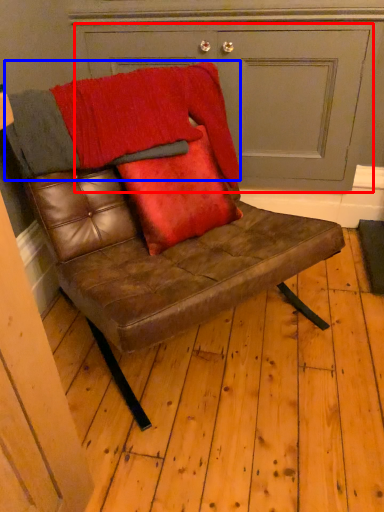
Question: Among these objects, which one is farthest to the camera, door (highlighted by a red box) or blanket (highlighted by a blue box)?

Choices:
 (A) door
 (B) blanket

Answer: (A)